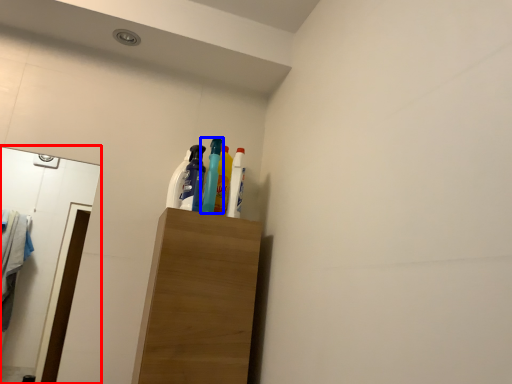
Question: Which point is further to the camera, mirror (highlighted by a red box) or bottle (highlighted by a blue box)?

Choices:
 (A) mirror
 (B) bottle

Answer: (B)